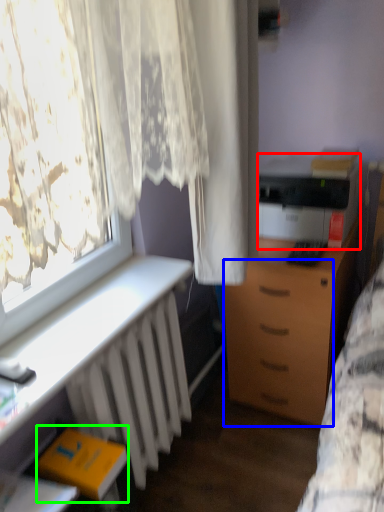
Question: Which object is positioned closest to printer (highlighted by a red box)? Select from drawer (highlighted by a blue box) and book (highlighted by a green box).

Choices:
 (A) drawer
 (B) book

Answer: (A)